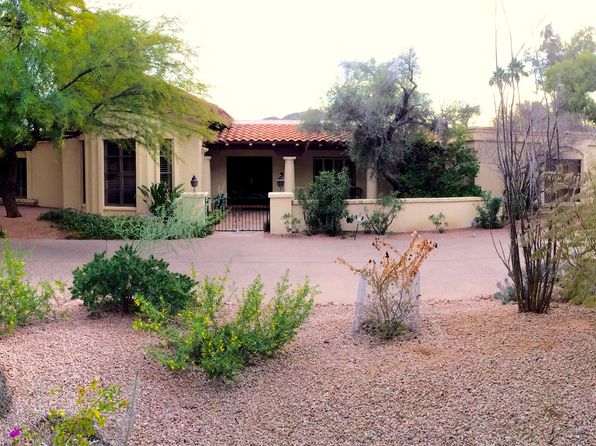
Locate an element on the screen. This screenshot has height=446, width=596. pillars is located at coordinates (287, 174), (375, 185).